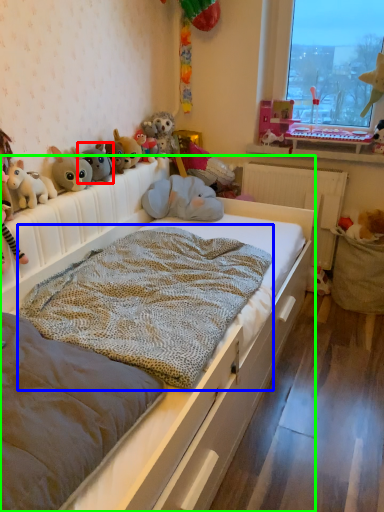
Question: Which is nearer to the toy (highlighted by a red box)? blanket (highlighted by a blue box) or bed (highlighted by a green box).

Choices:
 (A) blanket
 (B) bed

Answer: (A)